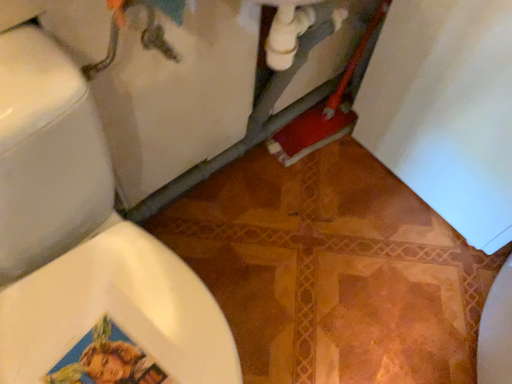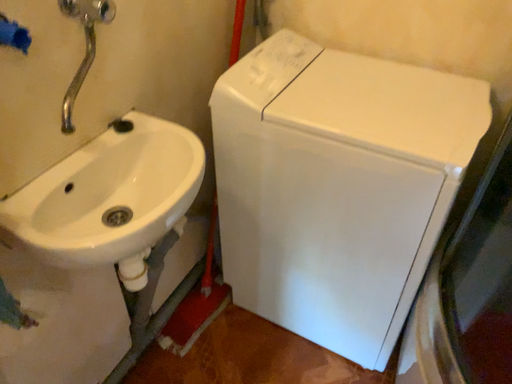
Question: Which way did the camera rotate in the video?

Choices:
 (A) rotated upward
 (B) rotated downward

Answer: (A)